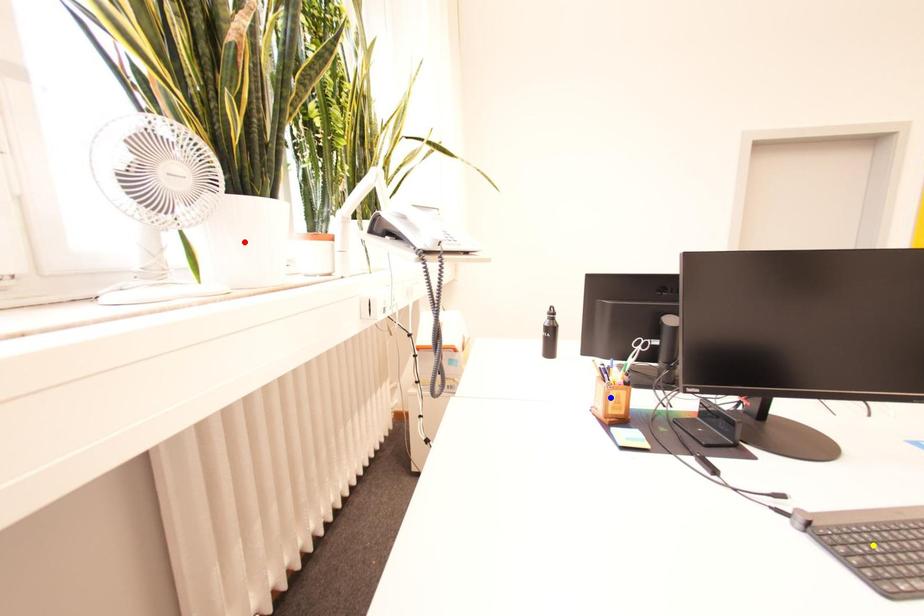
Order these from farthest to nearest:
1. red point
2. yellow point
3. blue point

1. red point
2. blue point
3. yellow point